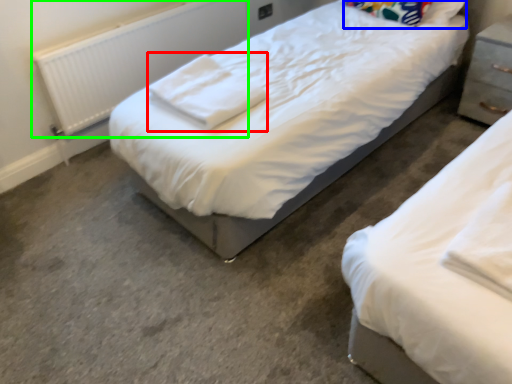
Question: Based on their relative distances, which object is nearer to cloth (highlighted by a red box)? Choose from pillow (highlighted by a blue box) and radiator (highlighted by a green box).

Choices:
 (A) pillow
 (B) radiator

Answer: (B)